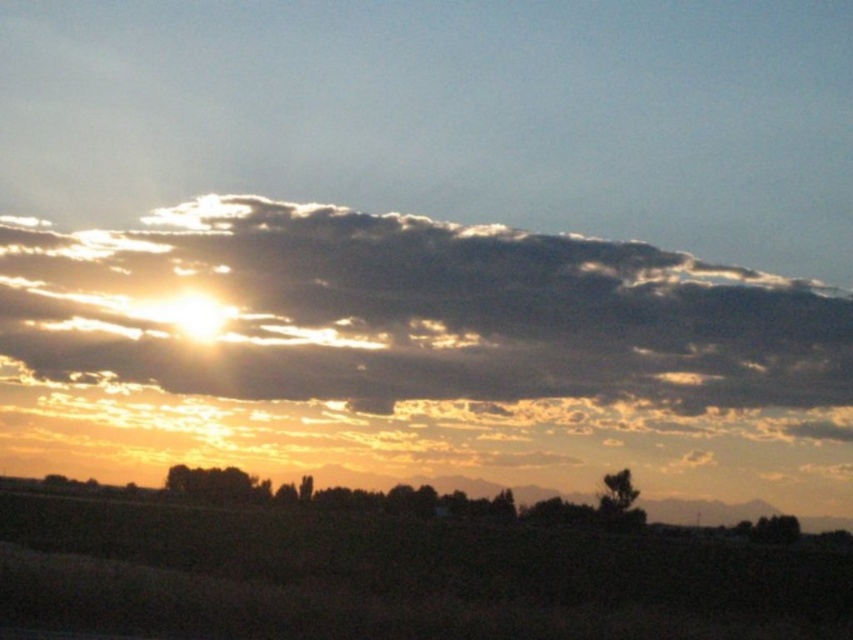
Which is more to the left, sandy brown cloud at upper center or brown grassland at lower center?

From the viewer's perspective, brown grassland at lower center appears more on the left side.

The width and height of the screenshot is (853, 640). Describe the element at coordinates (412, 314) in the screenshot. I see `sandy brown cloud at upper center` at that location.

Find the location of a particular element. This screenshot has height=640, width=853. sandy brown cloud at upper center is located at coordinates (412, 314).